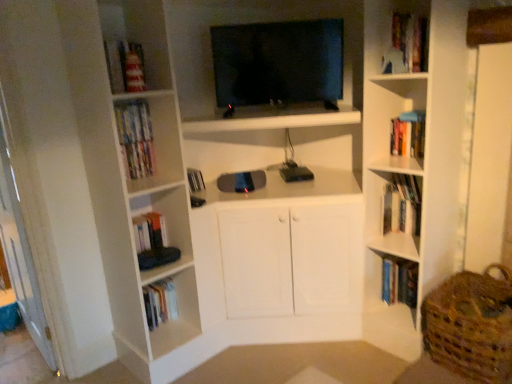
Identify the location of vacant space underneath matte plastic bookshelf at upper left, which appears as the 5th book when viewed from the right (from a real-world perspective). (131, 146).